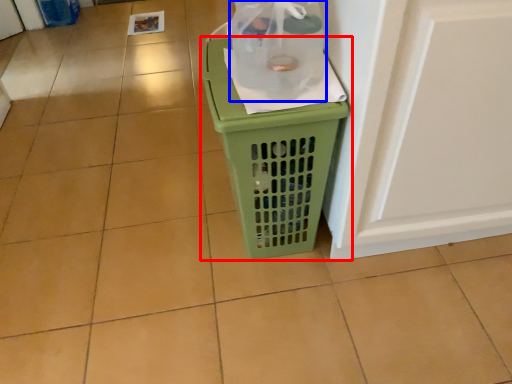
Question: Which object appears farthest to the camera in this image, waste container (highlighted by a red box) or bottle (highlighted by a blue box)?

Choices:
 (A) waste container
 (B) bottle

Answer: (A)